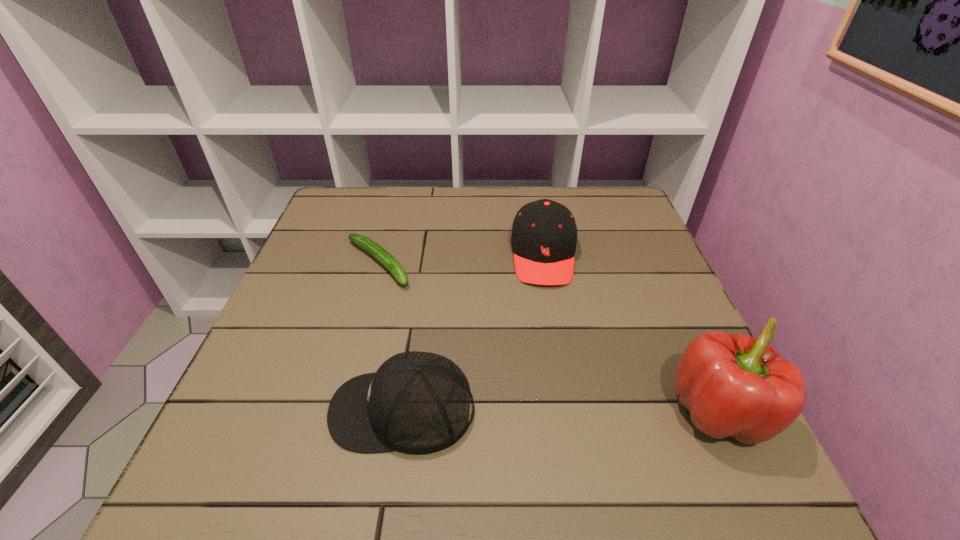
Image resolution: width=960 pixels, height=540 pixels. In order to click on empty location between the tallest object and the third object from left to right in this screenshot , I will do point(632,334).

Locate an element on the screen. This screenshot has width=960, height=540. free space between the nearer cap and the shortest object is located at coordinates (390, 336).

Where is `unoccupied area between the zucchini and the nearer cap`? This screenshot has height=540, width=960. unoccupied area between the zucchini and the nearer cap is located at coordinates (390, 336).

Where is `free space between the nearer cap and the pepper`? The image size is (960, 540). free space between the nearer cap and the pepper is located at coordinates (562, 411).

Locate an element on the screen. blank region between the pepper and the shortest object is located at coordinates (548, 338).

The width and height of the screenshot is (960, 540). What are the coordinates of `unoccupied area between the third object from left to right and the shortest object` in the screenshot? It's located at (461, 259).

Find the location of `the third closest object to the nearer cap`. the third closest object to the nearer cap is located at coordinates (736, 385).

At what (x,y) coordinates should I click in order to perform the action: click on object that is the third closest to the rightmost object. Please return your answer as a coordinate pair (x, y). Looking at the image, I should click on (376, 251).

What are the coordinates of `vacant space that satisfies the following two spatial constraints: 1. on the front side of the zucchini; 2. on the right side of the pepper` in the screenshot? It's located at (336, 413).

Find the location of a particular element. The width and height of the screenshot is (960, 540). free spot that satisfies the following two spatial constraints: 1. on the front side of the rightmost object; 2. on the left side of the shortest object is located at coordinates (336, 413).